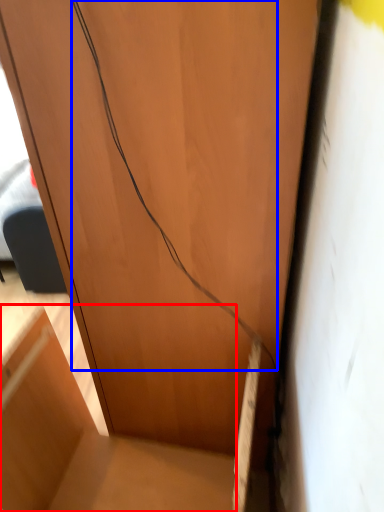
Question: Which of the following is the farthest to the observer, furniture (highlighted by a red box) or wire (highlighted by a blue box)?

Choices:
 (A) furniture
 (B) wire

Answer: (A)